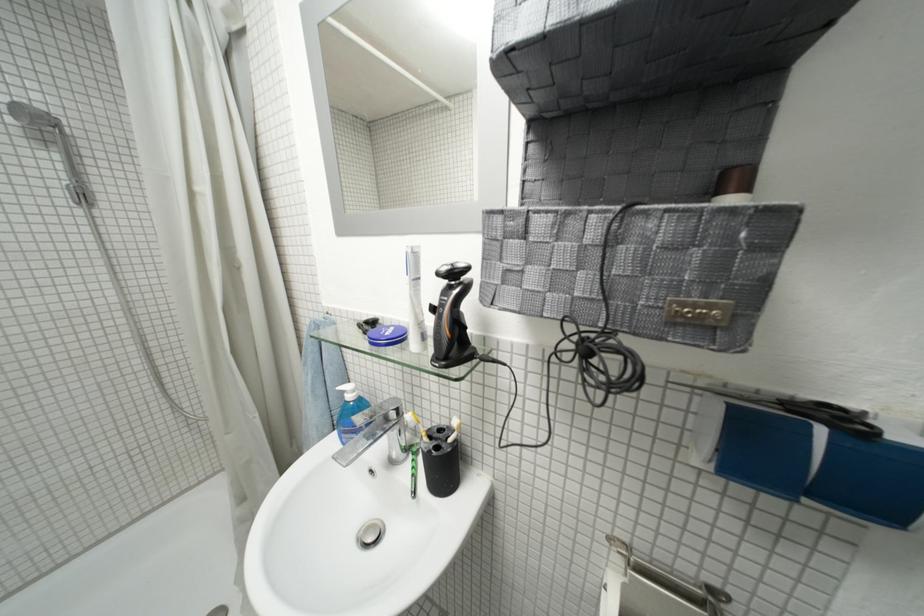
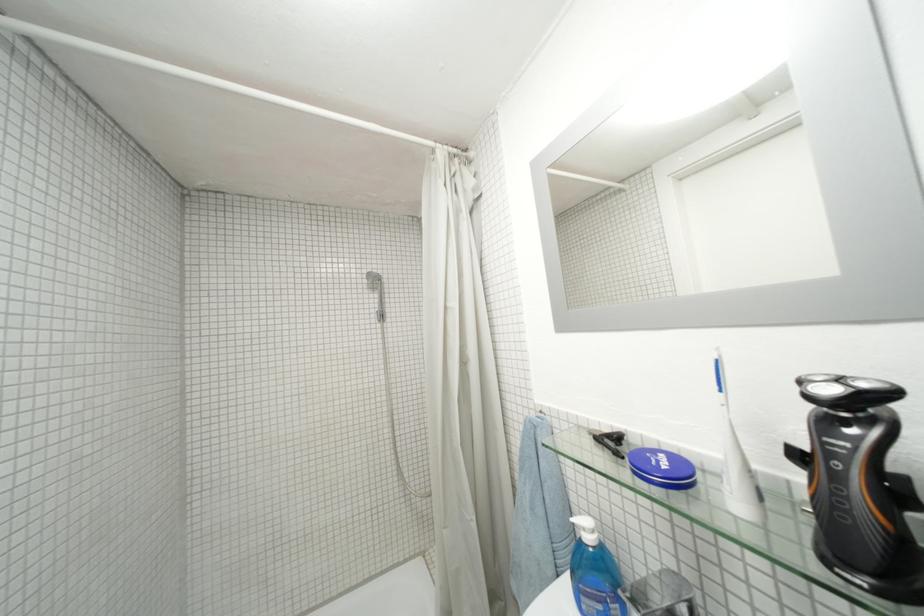
In the second image, find the point that corresponds to the point at 266,416 in the first image.

(482, 521)